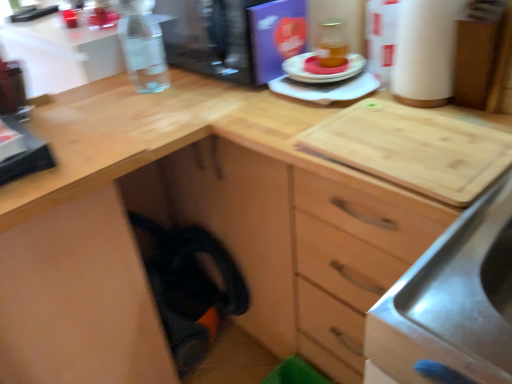
Locate an element on the screen. space that is in front of matte orange cake at center is located at coordinates (345, 92).